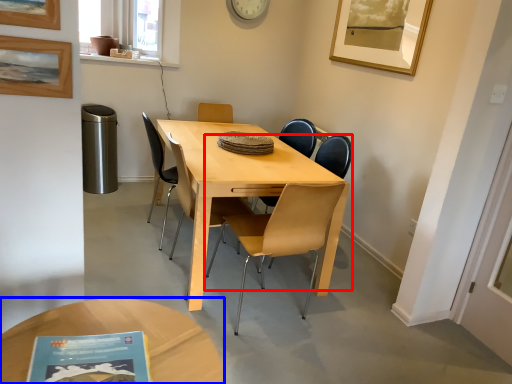
Question: Which object is further to the camera taking this photo, chair (highlighted by a red box) or coffee table (highlighted by a blue box)?

Choices:
 (A) chair
 (B) coffee table

Answer: (A)